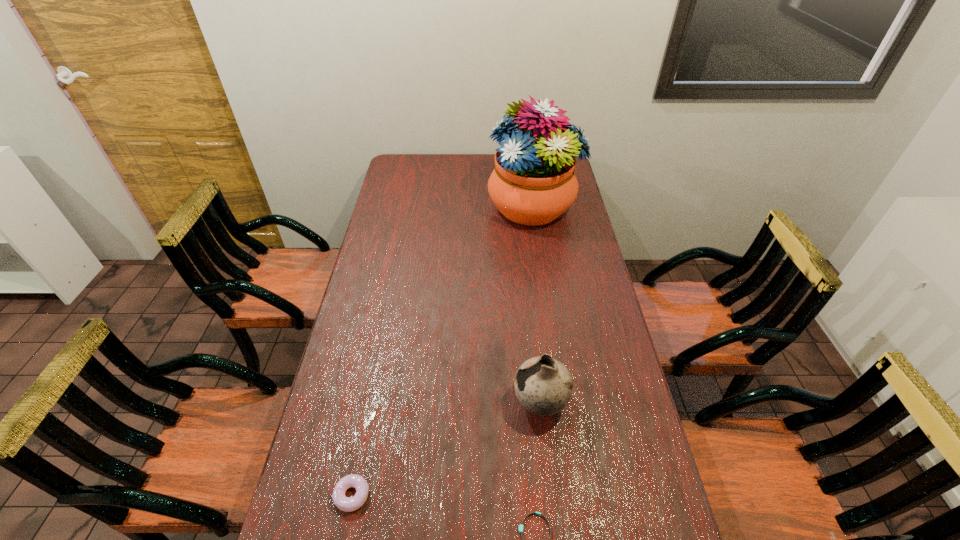
Find the location of a particular element. This screenshot has height=540, width=960. vacant area situated on the right of the doughnut is located at coordinates (480, 495).

You are a GUI agent. You are given a task and a screenshot of the screen. Output one action in this format:
    pyautogui.click(x=<x>, y=<y>)
    Task: Click on the object that is at the left edge
    
    Given the screenshot: What is the action you would take?
    pyautogui.click(x=347, y=504)

You are a GUI agent. You are given a task and a screenshot of the screen. Output one action in this format:
    pyautogui.click(x=<x>, y=<y>)
    Task: Click on the object that is at the right edge
    
    Given the screenshot: What is the action you would take?
    pyautogui.click(x=533, y=183)

Locate an element on the screen. The height and width of the screenshot is (540, 960). vacant space at the left edge of the desktop is located at coordinates (315, 444).

Locate an element on the screen. vacant space at the right edge of the desktop is located at coordinates (589, 436).

Locate an element on the screen. The image size is (960, 540). empty space between the third nearest object and the doughnut is located at coordinates (446, 449).

In order to click on free space between the leftmost object and the flower arrangement in this screenshot , I will do [x=443, y=350].

At what (x,y) coordinates should I click in order to perform the action: click on empty space that is in between the third nearest object and the tallest object. Please return your answer as a coordinate pair (x, y). Looking at the image, I should click on (537, 305).

You are a GUI agent. You are given a task and a screenshot of the screen. Output one action in this format:
    pyautogui.click(x=<x>, y=<y>)
    Task: Click on the free spot between the third tallest object and the tallest object
    The height and width of the screenshot is (540, 960).
    Given the screenshot: What is the action you would take?
    pyautogui.click(x=443, y=350)

Where is `vacant space that's between the leftmost object and the flower arrangement`? vacant space that's between the leftmost object and the flower arrangement is located at coordinates (443, 350).